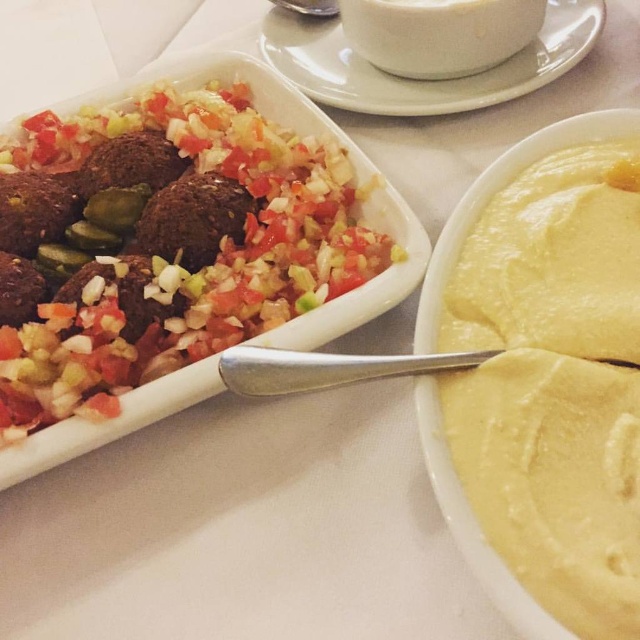
What is located at the coordinates point (172, 250)?

The coordinates point (172, 250) indicate the location of matte brown meatballs at left.

You are a food critic evaluating the presentation of the dishes in the image. Based on their visual characteristics, which object has a greater thickness between the matte brown meatballs at left and the white ceramic cup at upper center?

The white ceramic cup at upper center is thicker than the matte brown meatballs at left, so the white ceramic cup at upper center has a greater thickness.